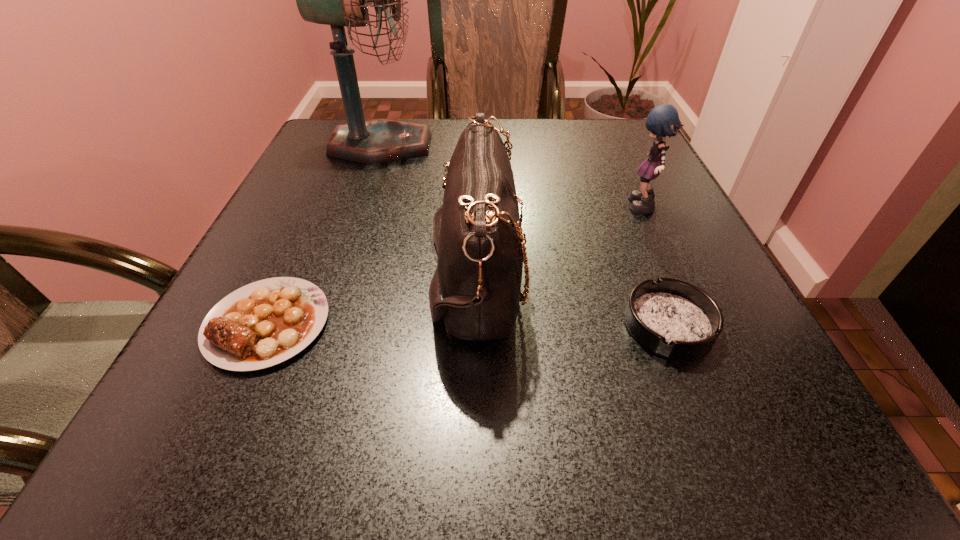
What are the coordinates of `vacant space at the near edge` in the screenshot? It's located at pyautogui.click(x=575, y=465).

Identify the location of free region at the left edge. (244, 257).

This screenshot has height=540, width=960. What are the coordinates of `free space between the handbag and the tallest object` in the screenshot? It's located at (428, 211).

You are a GUI agent. You are given a task and a screenshot of the screen. Output one action in this format:
    pyautogui.click(x=<x>, y=<y>)
    Task: Click on the vacant point located between the steak and the fan
    
    Given the screenshot: What is the action you would take?
    pyautogui.click(x=324, y=234)

Locate an element on the screen. This screenshot has height=540, width=960. blank region between the third object from left to right and the tallest object is located at coordinates (428, 211).

Locate an element on the screen. The height and width of the screenshot is (540, 960). free spot between the steak and the third object from left to right is located at coordinates (372, 300).

The image size is (960, 540). I want to click on free spot between the ashtray and the rag doll, so click(656, 267).

Locate an element on the screen. The image size is (960, 540). object that stands as the fourth closest to the farthest object is located at coordinates (676, 319).

Image resolution: width=960 pixels, height=540 pixels. In order to click on object that is the second closest to the handbag in this screenshot , I will do `click(676, 319)`.

Locate an element on the screen. vacant space that satisfies the following two spatial constraints: 1. on the front-facing side of the rag doll; 2. on the front side of the ashtray is located at coordinates (695, 325).